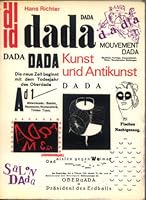
Where is `book cover`? The height and width of the screenshot is (200, 146). book cover is located at coordinates pyautogui.click(x=55, y=95).